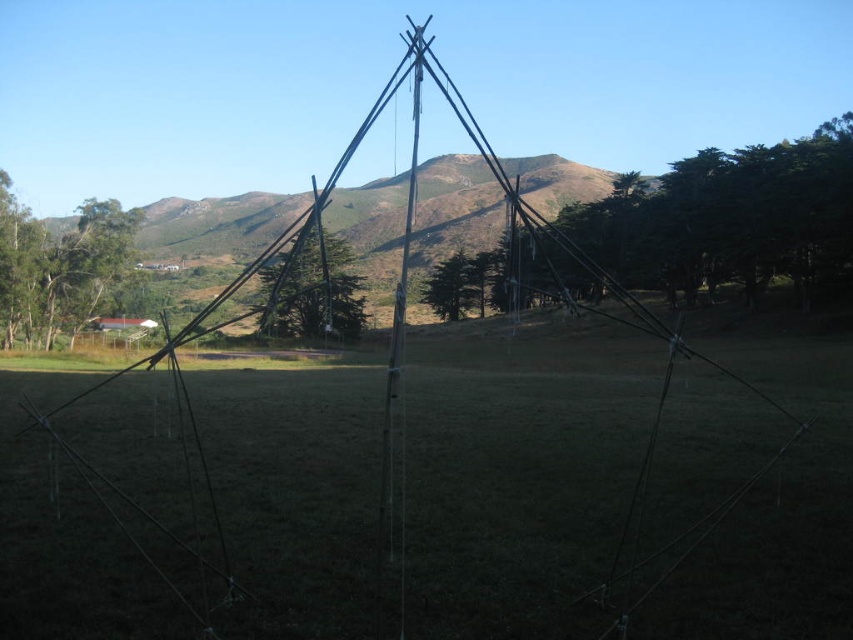
Question: Can you confirm if green leafy tree at center is thinner than green matte tree at center?

Choices:
 (A) yes
 (B) no

Answer: (B)

Question: Can you confirm if green leafy tree at center is positioned to the left of green matte tree at center?

Choices:
 (A) no
 (B) yes

Answer: (A)

Question: Does green leafy tree at center appear under green matte tree at left?

Choices:
 (A) no
 (B) yes

Answer: (A)

Question: Which of the following is the farthest from the observer?

Choices:
 (A) brown/dry grassy hill at center
 (B) green leafy tree at center

Answer: (A)

Question: Which object is farther from the camera taking this photo?

Choices:
 (A) green leafy tree at center
 (B) green matte tree at center
 (C) green matte tree at left

Answer: (C)

Question: Based on their relative distances, which object is farther from the green leafy tree at center?

Choices:
 (A) brown/dry grassy hill at center
 (B) green matte tree at center
 (C) green matte tree at left

Answer: (C)